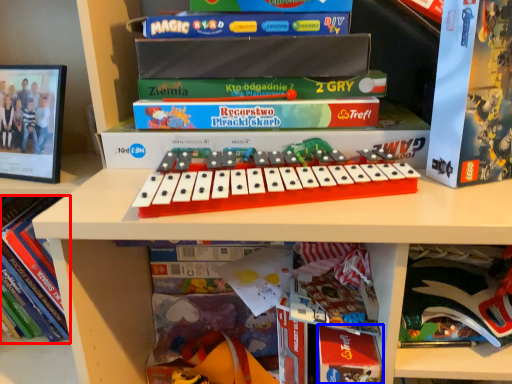
Question: Which point is further to the camera, book (highlighted by a red box) or paperback book (highlighted by a blue box)?

Choices:
 (A) book
 (B) paperback book

Answer: (A)